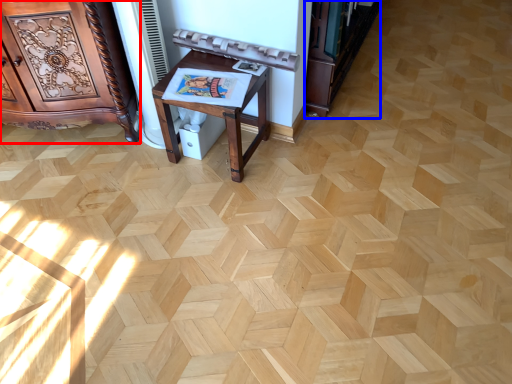
Question: Which point is further to the camera, furniture (highlighted by a red box) or bookshelf (highlighted by a blue box)?

Choices:
 (A) furniture
 (B) bookshelf

Answer: (B)